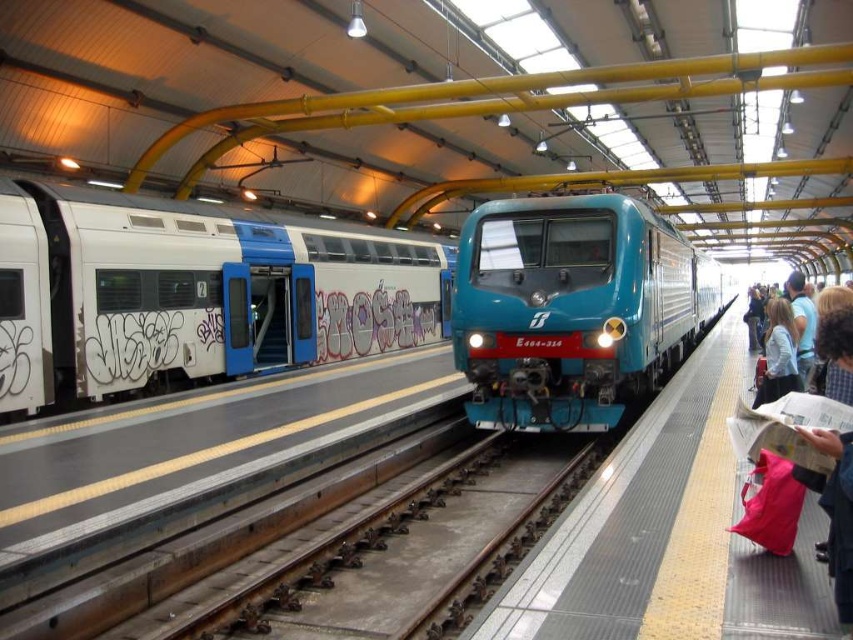
Can you confirm if white matte train at left is thinner than light brown hair at right?

Result: Correct, white matte train at left's width is less than light brown hair at right's.

How far apart are white matte train at left and light brown hair at right?

A distance of 42.23 feet exists between white matte train at left and light brown hair at right.

Which is in front, point (426, 330) or point (795, 292)?

Point (795, 292) is in front.

Find the location of a particular element. The width and height of the screenshot is (853, 640). white matte train at left is located at coordinates (190, 292).

Does white matte train at left appear under light blue fabric jacket at right?

No, white matte train at left is not below light blue fabric jacket at right.

Which of these two, white matte train at left or light blue fabric jacket at right, stands shorter?

With less height is light blue fabric jacket at right.

Consider the image. Measure the distance between point (x=352, y=355) and camera.

They are 63.05 feet apart.

Locate an element on the screen. This screenshot has width=853, height=640. white matte train at left is located at coordinates point(190,292).

Between teal glossy train at center and light blue fabric jacket at right, which one is positioned lower?

light blue fabric jacket at right

The image size is (853, 640). Describe the element at coordinates (572, 308) in the screenshot. I see `teal glossy train at center` at that location.

In order to click on teal glossy train at center in this screenshot , I will do `click(572, 308)`.